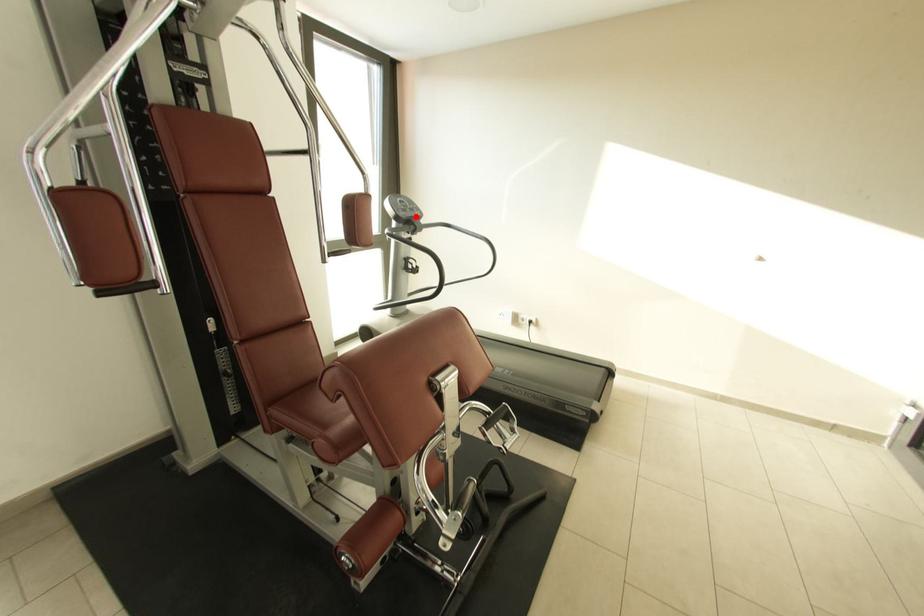
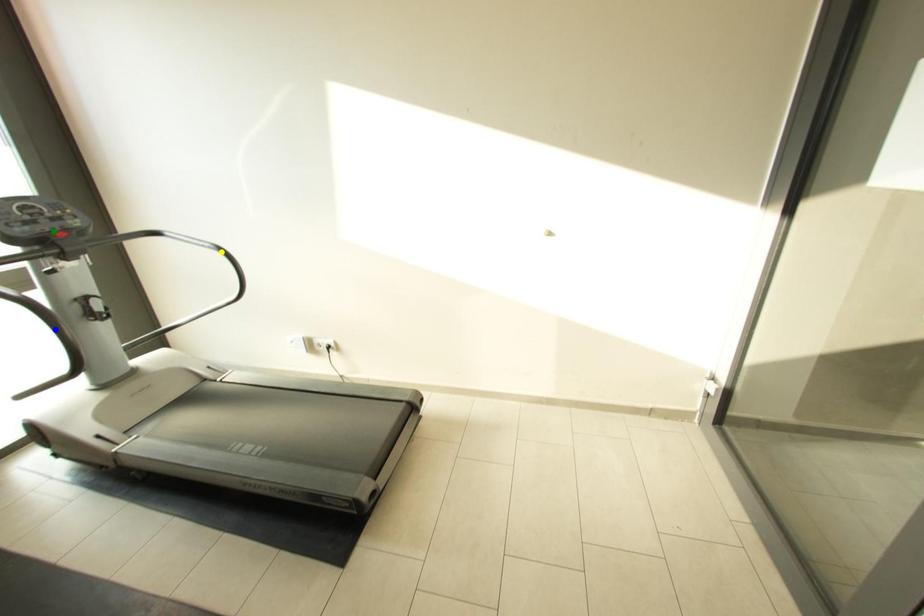
Question: I am providing you with two images of the same scene from different viewpoints. A red point is marked on the first image. You are given multiple points on the second image. Which spot in image 2 lines up with the point in image 1?

Choices:
 (A) green point
 (B) blue point
 (C) yellow point

Answer: (A)